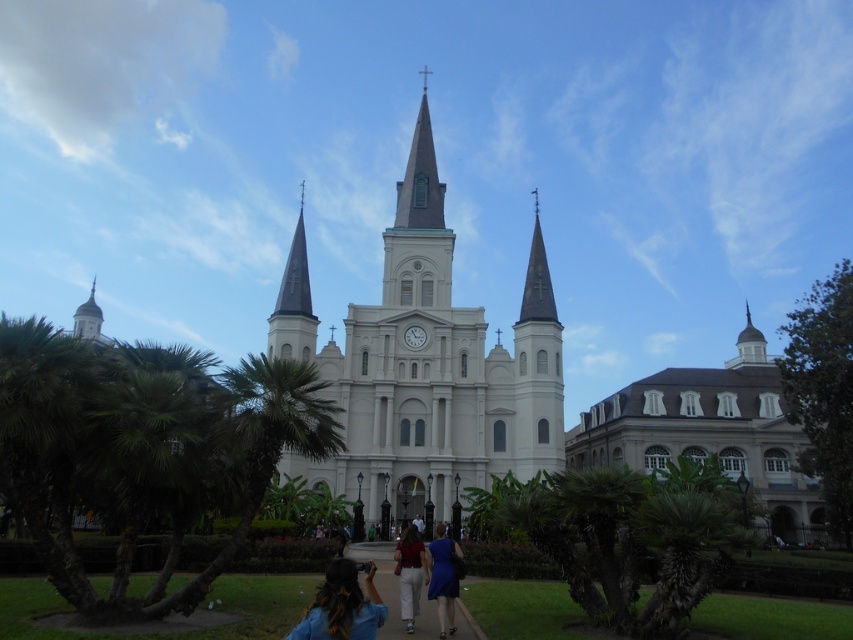
In the scene shown: Is white stone church tower at center further to camera compared to dark brown hair at lower center?

Yes.

Who is lower down, white stone church tower at center or dark brown hair at lower center?

dark brown hair at lower center

Who is more forward, (x=277, y=321) or (x=373, y=570)?

Point (x=373, y=570) is more forward.

The height and width of the screenshot is (640, 853). I want to click on white stone church tower at center, so click(426, 362).

Does blue satin dress at lower center appear on the right side of white cotton pants at center?

Correct, you'll find blue satin dress at lower center to the right of white cotton pants at center.

Is blue satin dress at lower center wider than white cotton pants at center?

In fact, blue satin dress at lower center might be narrower than white cotton pants at center.

Is point (450, 552) more distant than point (416, 544)?

No.

Identify the location of blue satin dress at lower center. The height and width of the screenshot is (640, 853). (444, 577).

Is white stone church tower at center taller than blue satin dress at lower center?

Correct, white stone church tower at center is much taller as blue satin dress at lower center.

From the picture: Who is shorter, white stone church tower at center or blue satin dress at lower center?

Standing shorter between the two is blue satin dress at lower center.

Is point (448, 323) more distant than point (451, 570)?

Yes, point (448, 323) is farther from viewer.

Locate an element on the screen. The width and height of the screenshot is (853, 640). white stone church tower at center is located at coordinates (426, 362).